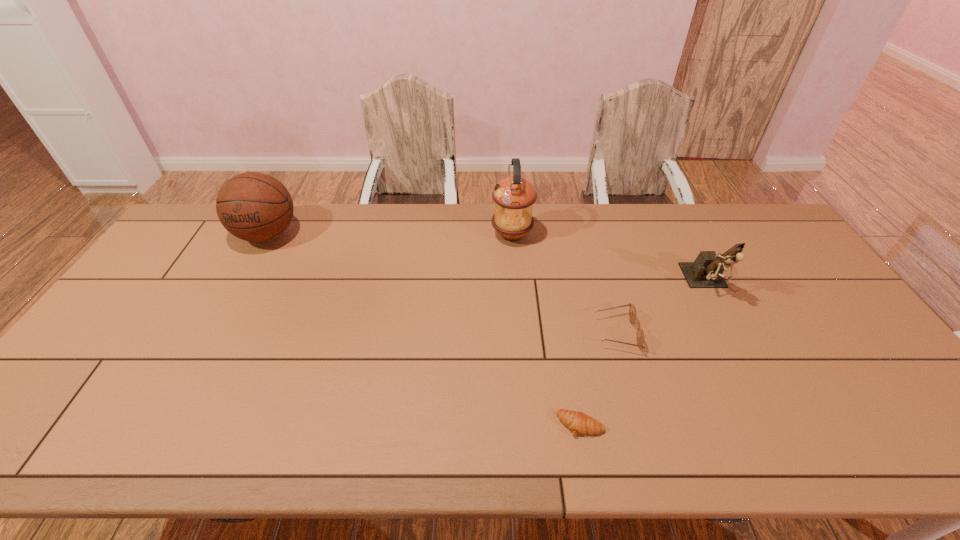
At what (x,y) coordinates should I click in order to perform the action: click on oil lamp. Please return your answer as a coordinate pair (x, y). Image resolution: width=960 pixels, height=540 pixels. Looking at the image, I should click on (514, 196).

Find the location of a particular element. the leftmost object is located at coordinates (256, 207).

Find the location of a particular element. the third farthest object is located at coordinates (706, 271).

The height and width of the screenshot is (540, 960). Find the location of `the rightmost object`. the rightmost object is located at coordinates (706, 271).

At what (x,y) coordinates should I click in order to perform the action: click on the second shortest object. Please return your answer as a coordinate pair (x, y). The height and width of the screenshot is (540, 960). Looking at the image, I should click on (640, 337).

Where is `the fourth farthest object`? This screenshot has width=960, height=540. the fourth farthest object is located at coordinates (640, 337).

This screenshot has width=960, height=540. In order to click on the shortest object in this screenshot , I will do `click(578, 422)`.

The height and width of the screenshot is (540, 960). What are the coordinates of `the nearest object` in the screenshot? It's located at (578, 422).

Locate an element on the screen. The width and height of the screenshot is (960, 540). vacant region located 0.180m on the left of the tallest object is located at coordinates (439, 235).

Where is `free spot located 0.230m on the side with brand label of the leftmost object`? Image resolution: width=960 pixels, height=540 pixels. free spot located 0.230m on the side with brand label of the leftmost object is located at coordinates (226, 309).